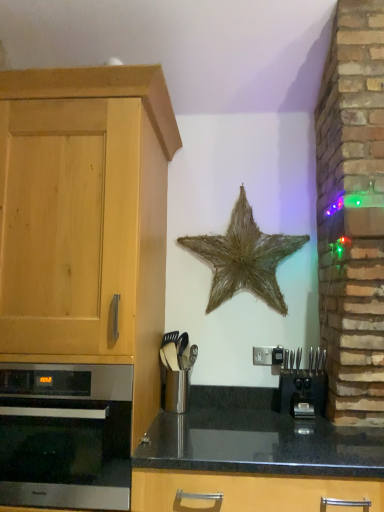
Question: From the image's perspective, does satin silver oven at left appear lower than black plastic coffee machine at lower right?

Choices:
 (A) yes
 (B) no

Answer: (A)

Question: Can you confirm if satin silver oven at left is taller than black plastic coffee machine at lower right?

Choices:
 (A) no
 (B) yes

Answer: (B)

Question: Can you confirm if satin silver oven at left is positioned to the right of black plastic coffee machine at lower right?

Choices:
 (A) no
 (B) yes

Answer: (A)

Question: From a real-world perspective, is satin silver oven at left on black plastic coffee machine at lower right?

Choices:
 (A) yes
 (B) no

Answer: (B)

Question: Does satin silver oven at left have a smaller size compared to black plastic coffee machine at lower right?

Choices:
 (A) yes
 (B) no

Answer: (B)

Question: Is satin silver oven at left positioned far away from black plastic coffee machine at lower right?

Choices:
 (A) yes
 (B) no

Answer: (B)

Question: Is light wood cabinet at left completely or partially outside of rustic straw star at center?

Choices:
 (A) yes
 (B) no

Answer: (A)

Question: Is light wood cabinet at left far from rustic straw star at center?

Choices:
 (A) yes
 (B) no

Answer: (B)

Question: From a real-world perspective, is light wood cabinet at left positioned over rustic straw star at center based on gravity?

Choices:
 (A) no
 (B) yes

Answer: (A)

Question: Can you confirm if light wood cabinet at left is bigger than rustic straw star at center?

Choices:
 (A) yes
 (B) no

Answer: (A)

Question: Does light wood cabinet at left have a lesser width compared to rustic straw star at center?

Choices:
 (A) yes
 (B) no

Answer: (B)

Question: Is light wood cabinet at left positioned in front of rustic straw star at center?

Choices:
 (A) yes
 (B) no

Answer: (A)

Question: From the image's perspective, is satin silver oven at left below black granite countertop at center?

Choices:
 (A) yes
 (B) no

Answer: (B)